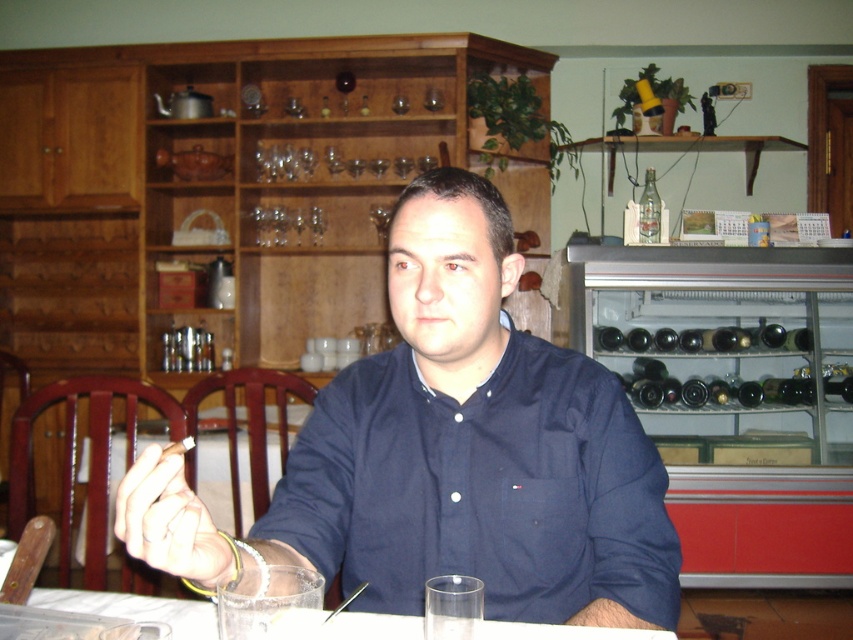
Question: Can you confirm if transparent glass at center is smaller than dark brown glass at upper center?

Choices:
 (A) no
 (B) yes

Answer: (A)

Question: Which object is the closest to the clear glassware at center?

Choices:
 (A) dark blue shirt at center
 (B) clear glass bottle at upper center
 (C) dark brown glass at upper center
 (D) smooth leather hand at center

Answer: (A)

Question: Which point is farther to the camera?

Choices:
 (A) (219, 444)
 (B) (131, 600)

Answer: (A)

Question: Observing the image, what is the correct spatial positioning of clear glass bottle at upper center in reference to dark brown glass at upper center?

Choices:
 (A) above
 (B) below

Answer: (B)

Question: Does dark blue shirt at center have a smaller size compared to transparent glass at center?

Choices:
 (A) yes
 (B) no

Answer: (B)

Question: Which object is the farthest from the smooth leather hand at center?

Choices:
 (A) transparent glass at center
 (B) clear plastic glass at lower center
 (C) dark blue shirt at center

Answer: (A)